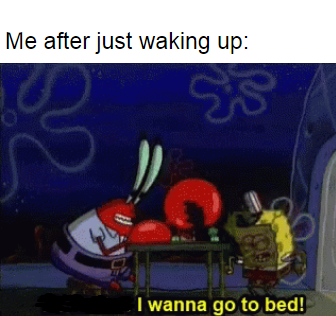
The image size is (336, 316). Identify the location of space above table. (195, 129).